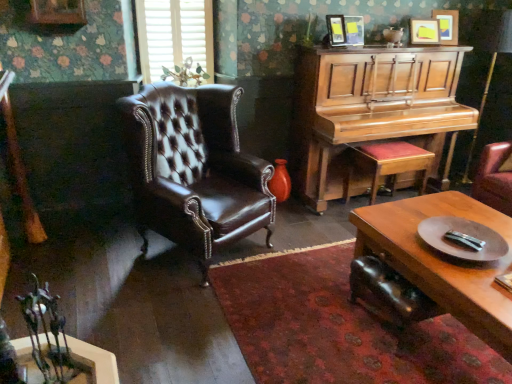
Question: From the image's perspective, is wooden stool with red cushion at right located above wooden piano at right?

Choices:
 (A) yes
 (B) no

Answer: (B)

Question: Is wooden piano at right at the back of wooden stool with red cushion at right?

Choices:
 (A) no
 (B) yes

Answer: (B)

Question: Considering the relative sizes of wooden stool with red cushion at right and wooden piano at right in the image provided, is wooden stool with red cushion at right taller than wooden piano at right?

Choices:
 (A) no
 (B) yes

Answer: (A)

Question: From a real-world perspective, is wooden stool with red cushion at right on top of wooden piano at right?

Choices:
 (A) yes
 (B) no

Answer: (B)

Question: Does wooden stool with red cushion at right have a smaller size compared to wooden piano at right?

Choices:
 (A) no
 (B) yes

Answer: (B)

Question: Based on their positions, is wooden polished coffee table at lower right located to the left or right of wooden piano at right?

Choices:
 (A) right
 (B) left

Answer: (A)

Question: Choose the correct answer: Is wooden polished coffee table at lower right inside wooden piano at right or outside it?

Choices:
 (A) outside
 (B) inside

Answer: (A)

Question: Is point (457, 281) positioned closer to the camera than point (328, 67)?

Choices:
 (A) closer
 (B) farther

Answer: (A)

Question: From the image's perspective, is wooden polished coffee table at lower right positioned above or below wooden piano at right?

Choices:
 (A) below
 (B) above

Answer: (A)

Question: Considering the positions of point (406, 168) and point (446, 26), is point (406, 168) closer or farther from the camera than point (446, 26)?

Choices:
 (A) closer
 (B) farther

Answer: (A)

Question: Considering the positions of wooden stool with red cushion at right and matte wooden picture frame at upper right, the fourth picture frame positioned from the left, in the image, is wooden stool with red cushion at right taller or shorter than matte wooden picture frame at upper right, the fourth picture frame positioned from the left,?

Choices:
 (A) short
 (B) tall

Answer: (B)

Question: In the image, is wooden stool with red cushion at right positioned in front of or behind matte wooden picture frame at upper right, which is the 1th picture frame from right to left?

Choices:
 (A) behind
 (B) front

Answer: (B)

Question: Based on their positions, is wooden stool with red cushion at right located to the left or right of matte wooden picture frame at upper right, which is the 1th picture frame from right to left?

Choices:
 (A) left
 (B) right

Answer: (A)

Question: From a real-world perspective, is wooden stool with red cushion at right above or below wooden piano at right?

Choices:
 (A) above
 (B) below

Answer: (B)

Question: Considering the positions of wooden stool with red cushion at right and wooden piano at right in the image, is wooden stool with red cushion at right wider or thinner than wooden piano at right?

Choices:
 (A) thin
 (B) wide

Answer: (A)